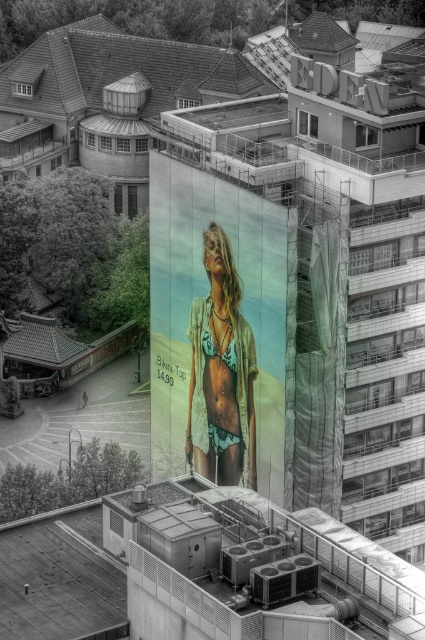
Question: Which point is closer to the camera?

Choices:
 (A) (220, 208)
 (B) (218, 346)

Answer: (A)

Question: Among these objects, which one is farthest from the camera?

Choices:
 (A) metallic bikini top at center
 (B) matte green bikini top at center

Answer: (B)

Question: From the image, what is the correct spatial relationship of metallic bikini top at center in relation to matte green bikini top at center?

Choices:
 (A) above
 (B) below

Answer: (A)

Question: Can you confirm if metallic bikini top at center is positioned to the right of matte green bikini top at center?

Choices:
 (A) no
 (B) yes

Answer: (A)

Question: Does metallic bikini top at center come in front of matte green bikini top at center?

Choices:
 (A) yes
 (B) no

Answer: (A)

Question: Which point appears closest to the camera in this image?

Choices:
 (A) (241, 381)
 (B) (241, 204)

Answer: (B)